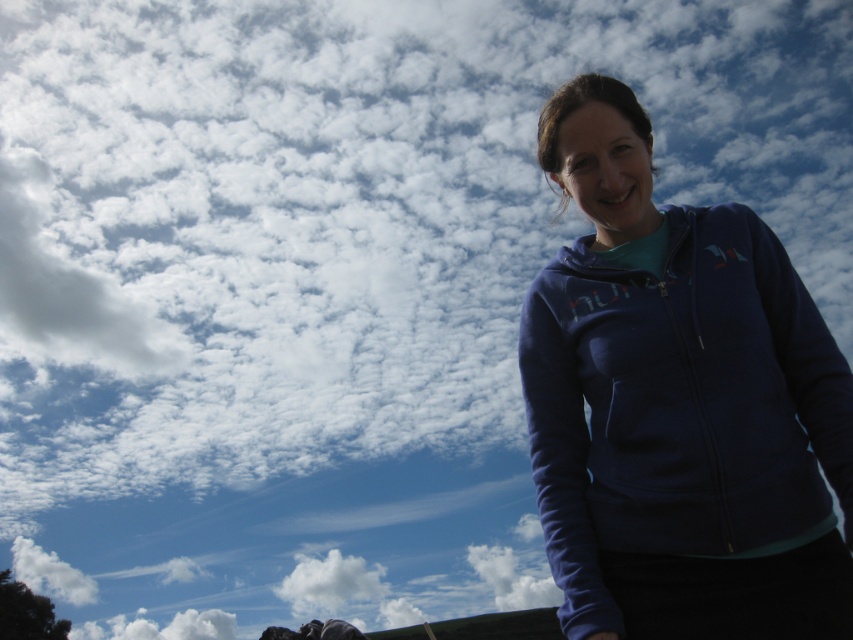
Between blue fleece jacket at right and white fluffy cloud at lower center, which one is positioned lower?

Positioned lower is white fluffy cloud at lower center.

Does blue fleece jacket at right appear over white fluffy cloud at lower center?

Yes, blue fleece jacket at right is above white fluffy cloud at lower center.

Who is more distant from viewer, (611, 420) or (338, 570)?

The point (338, 570) is more distant.

Identify the location of blue fleece jacket at right. (679, 404).